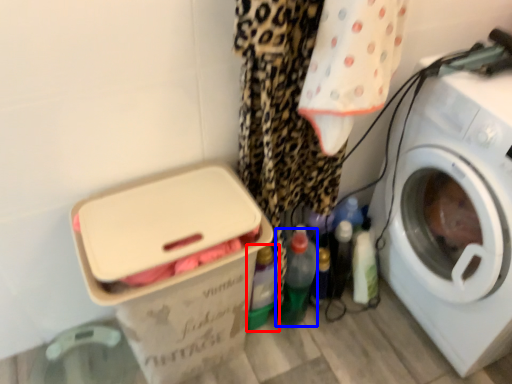
Question: Which of the following is the closest to the observer, bottle (highlighted by a red box) or bottle (highlighted by a blue box)?

Choices:
 (A) bottle
 (B) bottle

Answer: (A)